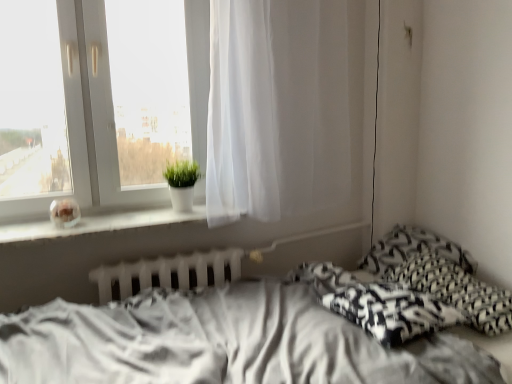
Identify the location of free point below green matte plant at window (from a real-world perspective). The image size is (512, 384). (181, 211).